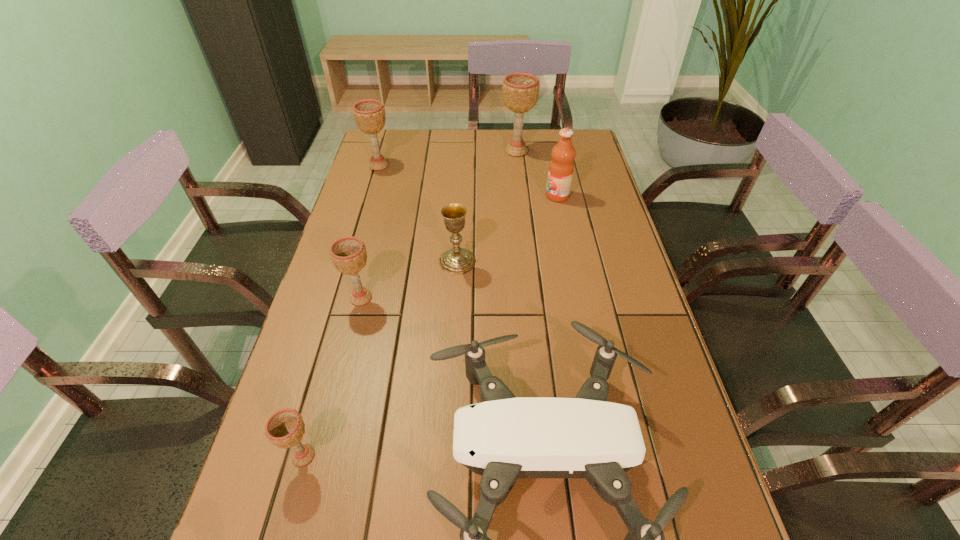
Where is `vacant point located between the second tallest chalice and the third farthest object`? This screenshot has width=960, height=540. vacant point located between the second tallest chalice and the third farthest object is located at coordinates (468, 180).

This screenshot has height=540, width=960. What are the coordinates of `free spot between the second chalice from right to left and the smallest beige chalice` in the screenshot? It's located at (380, 359).

Identify which object is the fifth nearest to the fruit juice. Please provide its 2D coordinates. Your answer should be formatted as a tuple, i.e. [(x, y)], where the tuple contains the x and y coordinates of a point satisfying the conditions above.

[(348, 254)]

Locate an element on the screen. The width and height of the screenshot is (960, 540). object that can be found as the fifth closest to the tallest chalice is located at coordinates (504, 438).

This screenshot has width=960, height=540. Identify the location of chalice that stands as the fourth closest to the fourth chalice from left to right. (285, 428).

I want to click on the fourth closest chalice to the fruit juice, so click(348, 254).

At what (x,y) coordinates should I click in order to perform the action: click on beige chalice that is the closest to the second biggest beige chalice. Please return your answer as a coordinate pair (x, y). The height and width of the screenshot is (540, 960). Looking at the image, I should click on (520, 90).

Locate an element on the screen. The width and height of the screenshot is (960, 540). beige chalice object that ranks as the third closest to the fourth farthest object is located at coordinates (520, 90).

The image size is (960, 540). I want to click on free point that satisfies the following two spatial constraints: 1. on the front side of the second biggest beige chalice; 2. on the right side of the smallest beige chalice, so click(294, 455).